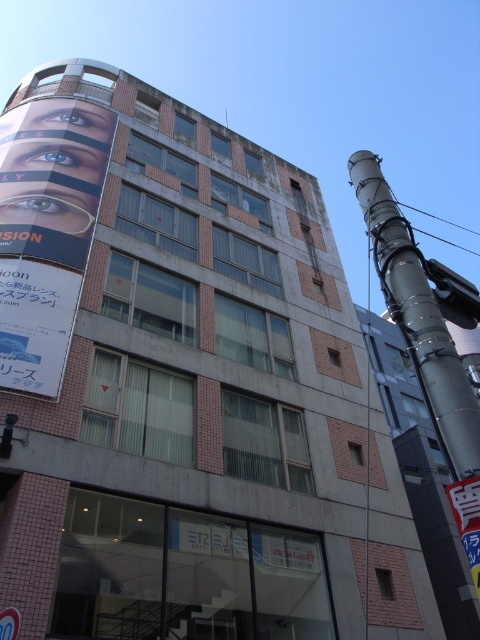
Measure the distance between matte black banner at upper left and white plastic sign at center.

The distance of matte black banner at upper left from white plastic sign at center is 34.19 feet.

Who is lower down, matte black banner at upper left or white plastic sign at center?

white plastic sign at center

In order to click on matte black banner at upper left in this screenshot , I will do `click(47, 232)`.

Who is positioned more to the right, metallic gray pole at right or white plastic sign at center?

From the viewer's perspective, metallic gray pole at right appears more on the right side.

Who is more forward, (381,266) or (9,608)?

Point (381,266)

Is point (436, 328) positioned in front of point (7, 620)?

Yes, it is.

The image size is (480, 640). I want to click on metallic gray pole at right, so click(x=420, y=320).

Who is more distant from viewer, (92, 198) or (444, 381)?

The point (92, 198) is more distant.

In the scene shown: Is matte black banner at upper left to the right of metallic gray pole at right from the viewer's perspective?

In fact, matte black banner at upper left is to the left of metallic gray pole at right.

Where is `matte black banner at upper left`? matte black banner at upper left is located at coordinates (47, 232).